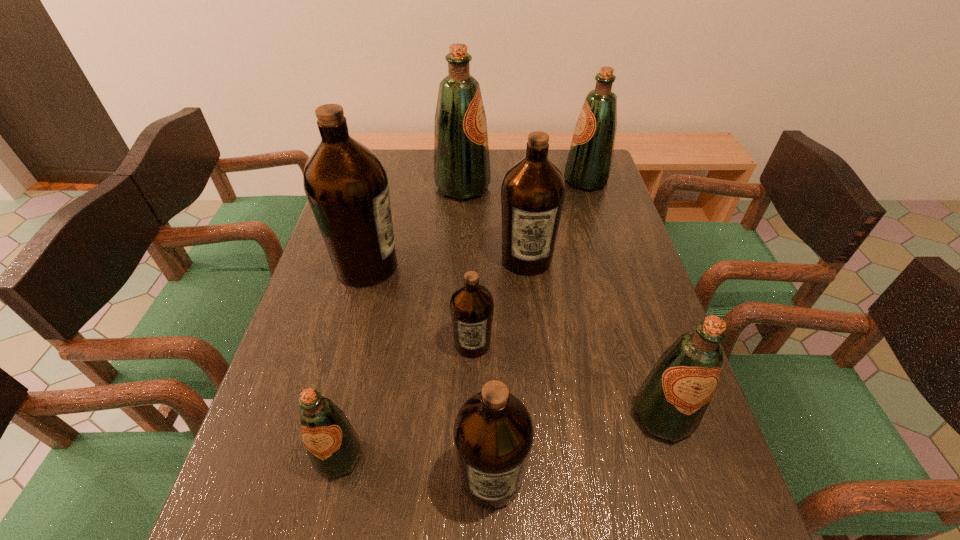
Where is `free spot located on the label of the biggest brown olive oil`? The height and width of the screenshot is (540, 960). free spot located on the label of the biggest brown olive oil is located at coordinates pyautogui.click(x=477, y=266).

The image size is (960, 540). I want to click on vacant space located on the label of the third smallest brown olive oil, so click(x=532, y=307).

Locate an element on the screen. The width and height of the screenshot is (960, 540). free spot located on the front-facing side of the second biggest green olive oil is located at coordinates (546, 181).

The height and width of the screenshot is (540, 960). What are the coordinates of `free space located on the front-facing side of the second biggest green olive oil` in the screenshot? It's located at (496, 181).

You are a GUI agent. You are given a task and a screenshot of the screen. Output one action in this format:
    pyautogui.click(x=<x>, y=<y>)
    Task: Click on the vacant space situated on the front-facing side of the second biggest green olive oil
    This screenshot has width=960, height=540.
    Given the screenshot: What is the action you would take?
    pyautogui.click(x=450, y=181)

Where is `free space located on the front-facing side of the second smallest green olive oil`? The image size is (960, 540). free space located on the front-facing side of the second smallest green olive oil is located at coordinates (693, 512).

I want to click on free point located on the label of the fifth farthest object, so click(471, 427).

The image size is (960, 540). I want to click on vacant space situated on the front-facing side of the leftmost green olive oil, so click(x=321, y=536).

This screenshot has width=960, height=540. In order to click on object located at the far right corner in this screenshot , I will do `click(588, 167)`.

This screenshot has width=960, height=540. In order to click on free spot at the far edge of the desktop in this screenshot , I will do `click(503, 153)`.